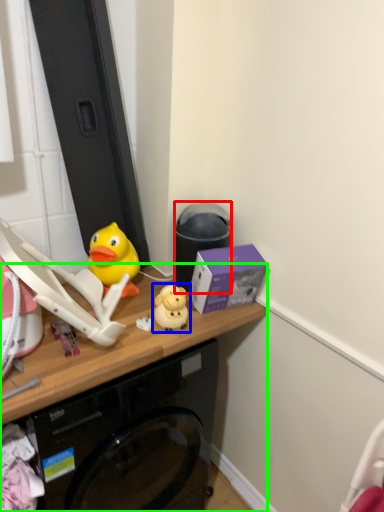
Question: Considering the real-world distances, which object is closest to trash bin/can (highlighted by a red box)? toy (highlighted by a blue box) or desk (highlighted by a green box).

Choices:
 (A) toy
 (B) desk

Answer: (A)